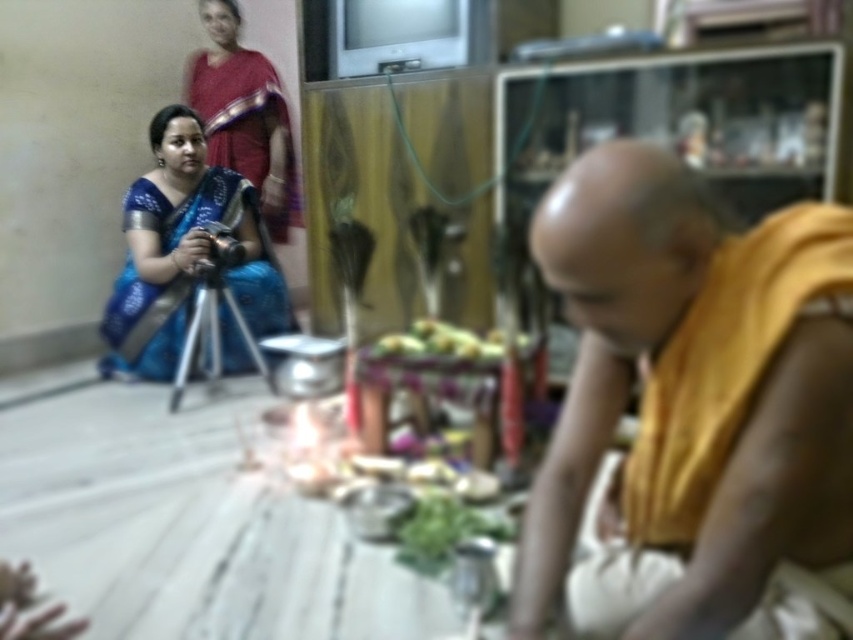
Which is behind, point (554, 493) or point (219, 113)?

Point (219, 113)

Is yellow clothed monk at center bigger than matte red saree at upper left?

Incorrect, yellow clothed monk at center is not larger than matte red saree at upper left.

Where is `yellow clothed monk at center`? The image size is (853, 640). yellow clothed monk at center is located at coordinates (694, 406).

What are the coordinates of `yellow clothed monk at center` in the screenshot? It's located at (694, 406).

Is matte red saree at upper left further to the viewer compared to yellowish matte fruit at center?

Yes, it is behind yellowish matte fruit at center.

Is point (248, 86) less distant than point (453, 336)?

No.

The width and height of the screenshot is (853, 640). What are the coordinates of `matte red saree at upper left` in the screenshot? It's located at (244, 124).

You are a GUI agent. You are given a task and a screenshot of the screen. Output one action in this format:
    pyautogui.click(x=<x>, y=<y>)
    Task: Click on the matte red saree at upper left
    The height and width of the screenshot is (640, 853).
    Given the screenshot: What is the action you would take?
    pyautogui.click(x=244, y=124)

Is blue silk saree at left positioned behind matte red saree at upper left?

No, blue silk saree at left is closer to the viewer.

Who is more forward, (265,275) or (242,132)?

Positioned in front is point (265,275).

At what (x,y) coordinates should I click in order to perform the action: click on blue silk saree at left. Please return your answer as a coordinate pair (x, y). The width and height of the screenshot is (853, 640). Looking at the image, I should click on (183, 252).